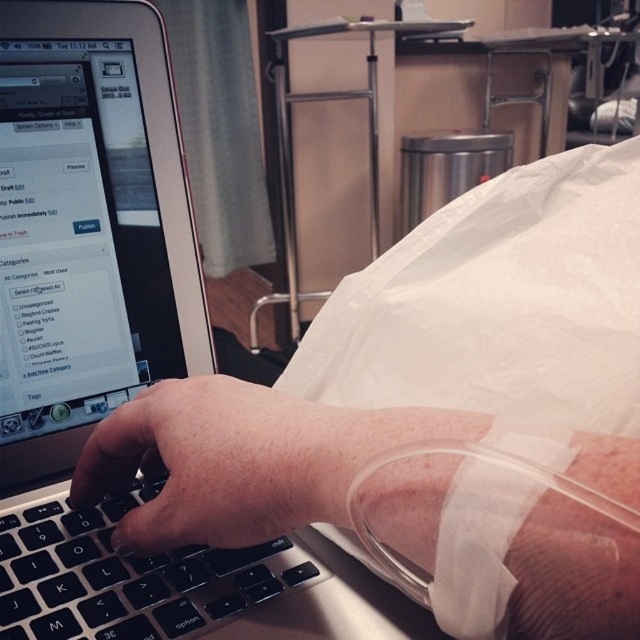
Is sleek silver laptop at center taller than smooth skin hand at center?

Yes.

Does sleek silver laptop at center have a larger size compared to smooth skin hand at center?

Yes, sleek silver laptop at center is bigger than smooth skin hand at center.

Which is in front, point (145, 592) or point (225, 504)?

Point (225, 504) is in front.

Identify the location of sleek silver laptop at center. point(99,323).

Can you confirm if skinny white hand at center is smaller than smooth skin hand at center?

Actually, skinny white hand at center might be larger than smooth skin hand at center.

I want to click on skinny white hand at center, so click(241, 460).

Image resolution: width=640 pixels, height=640 pixels. What are the coordinates of `skinny white hand at center` in the screenshot? It's located at (241, 460).

Which is below, skinny white hand at center or satin black laptop at center?

skinny white hand at center is below.

Is skinny white hand at center to the left of satin black laptop at center from the viewer's perspective?

No, skinny white hand at center is not to the left of satin black laptop at center.

Who is more distant from viewer, (602, 625) or (166, 353)?

The point (166, 353) is behind.

Where is `skinny white hand at center`? This screenshot has width=640, height=640. skinny white hand at center is located at coordinates (241, 460).